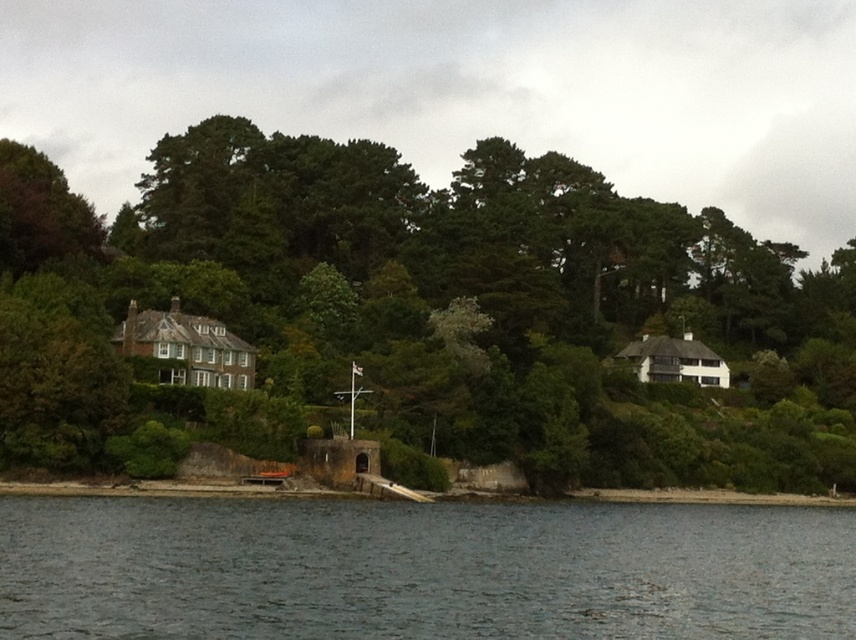
Which is in front, point (758, 394) or point (33, 504)?

Point (33, 504) is more forward.

Where is `green leafy tree at center`? The image size is (856, 640). green leafy tree at center is located at coordinates (419, 314).

Describe the element at coordinates (419, 314) in the screenshot. I see `green leafy tree at center` at that location.

Identify the location of green leafy tree at center. (419, 314).